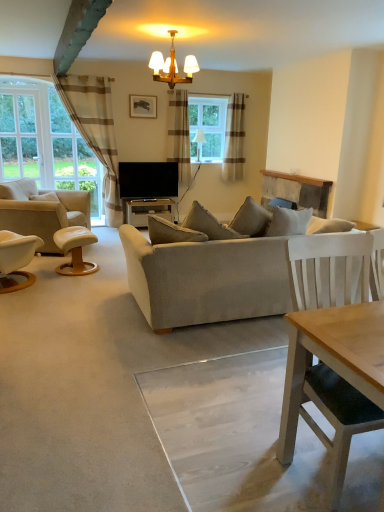
The height and width of the screenshot is (512, 384). I want to click on vacant area that is in front of light beige fabric couch at center, so pyautogui.click(x=170, y=385).